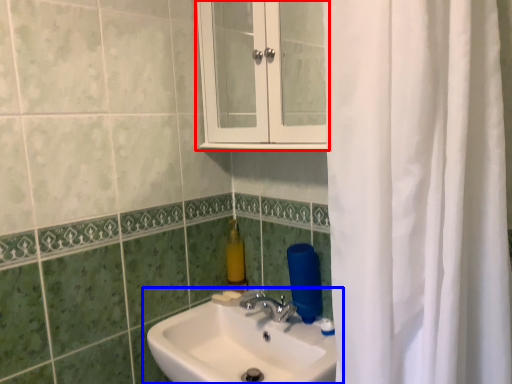
Question: Which point is closer to the camera, medicine cabinet (highlighted by a red box) or sink (highlighted by a blue box)?

Choices:
 (A) medicine cabinet
 (B) sink

Answer: (B)